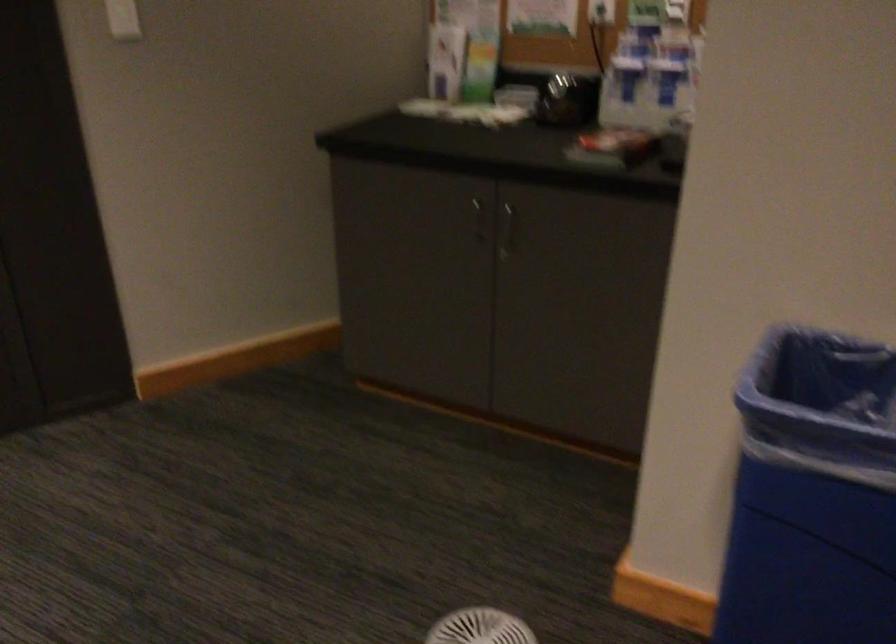
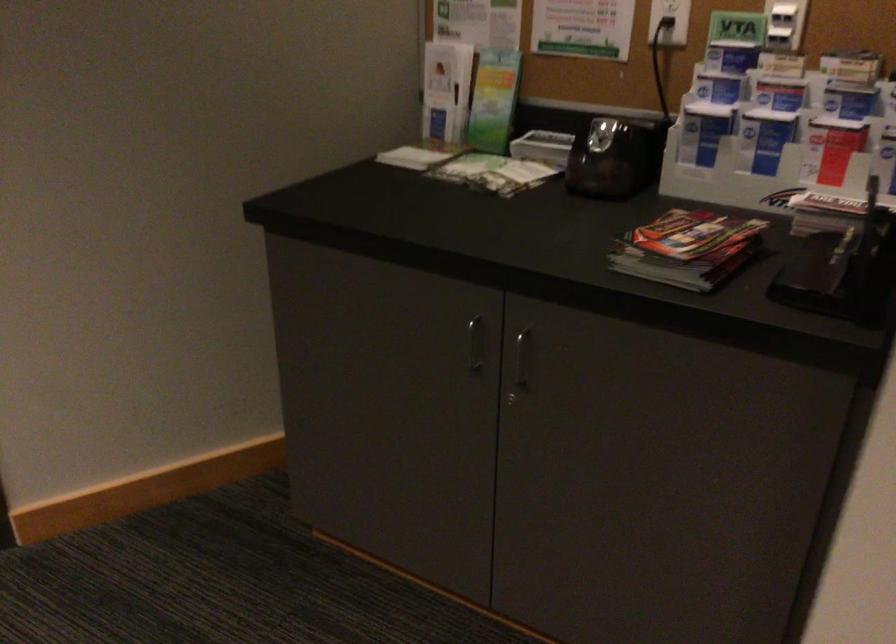
Find the pixel in the second image that matches [478,218] in the first image.

(475, 343)